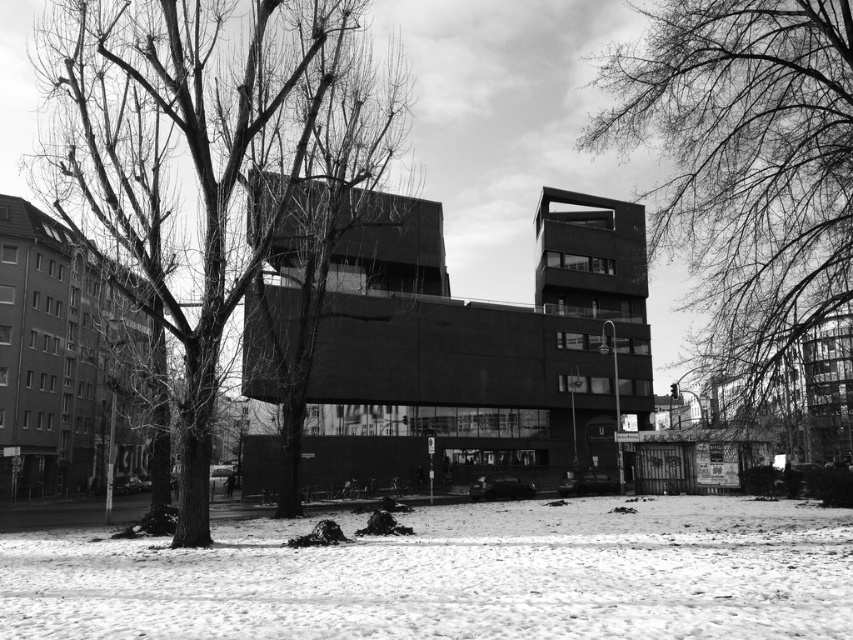
Question: Can you confirm if bare branches at upper right is positioned above bare branches at center?

Choices:
 (A) yes
 (B) no

Answer: (B)

Question: Which object is the farthest from the smooth bark tree at center?

Choices:
 (A) white powdery snow at lower center
 (B) bare branches at upper right

Answer: (B)

Question: Which object appears farthest from the camera in this image?

Choices:
 (A) bare branches at center
 (B) white powdery snow at lower center
 (C) smooth bark tree at center
 (D) bare branches at upper right

Answer: (A)

Question: Can you confirm if smooth bark tree at center is positioned to the left of bare branches at upper right?

Choices:
 (A) yes
 (B) no

Answer: (A)

Question: Does smooth bark tree at center have a larger size compared to bare branches at center?

Choices:
 (A) no
 (B) yes

Answer: (B)

Question: Which object appears closest to the camera in this image?

Choices:
 (A) smooth bark tree at center
 (B) bare branches at upper right
 (C) white powdery snow at lower center
 (D) bare branches at center

Answer: (C)